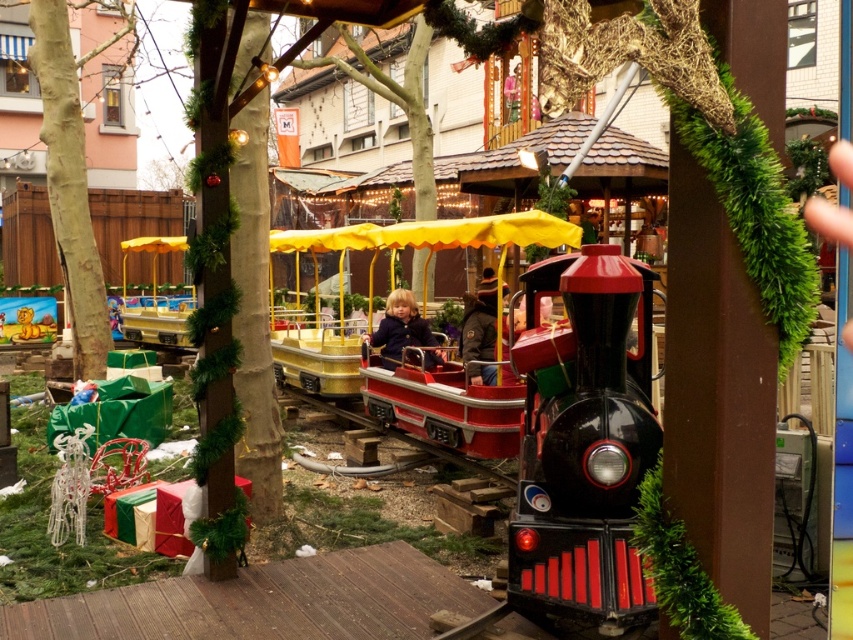
You are a parent trying to decide if your child can safely sit on the shiny red plastic train at center while wearing the dark brown leather jacket at center. Based on their sizes, will the jacket interfere with the child sitting comfortably?

The shiny red plastic train at center is shorter than the dark brown leather jacket at center. This means the jacket may not allow the child to sit comfortably as it is taller than the train seat.

You are a parent at the Christmas market and see the green rough bark tree at left and the dark brown leather jacket at center. Which object is shorter?

The green rough bark tree at left is shorter than the dark brown leather jacket at center.